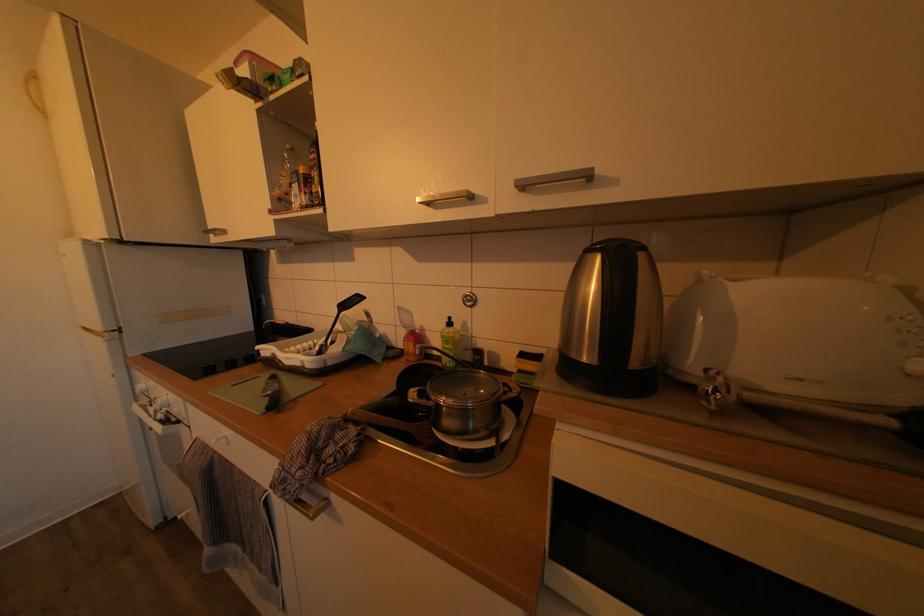
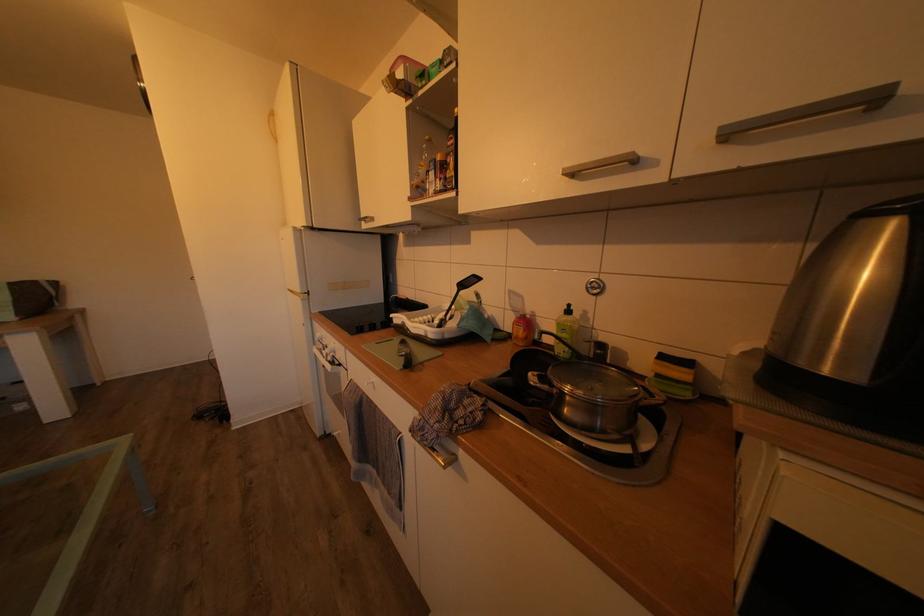
Locate, in the second image, the point that corresponds to the point at 410,359 in the first image.

(517, 342)